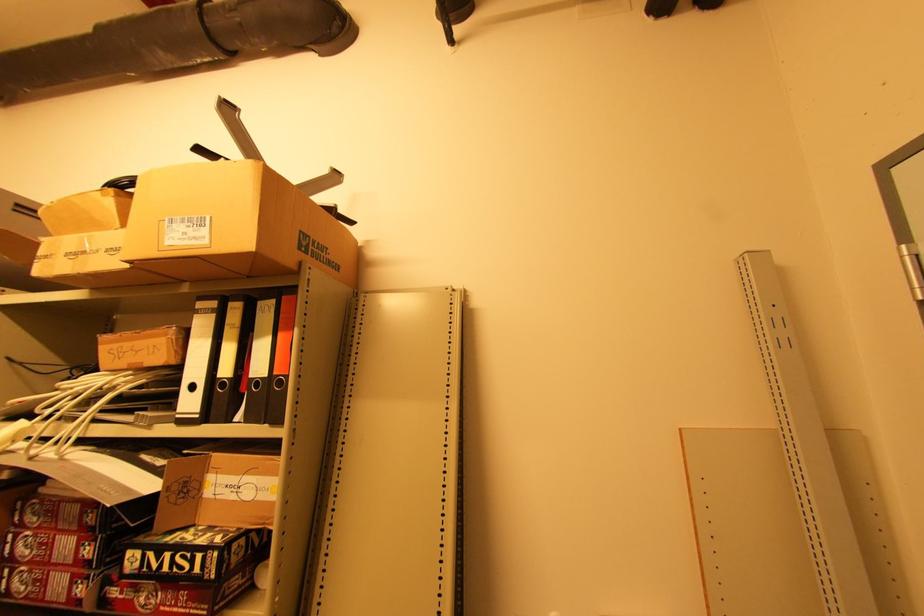
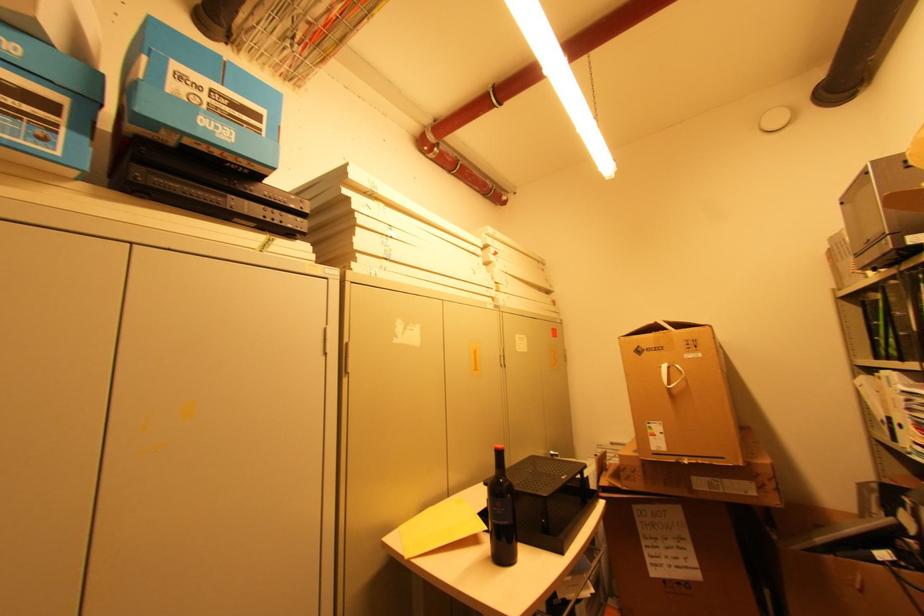
Question: The camera is either moving clockwise (left) or counter-clockwise (right) around the object. The first image is from the beginning of the video and the second image is from the end. Is the camera moving left or right when shooting the video?

Choices:
 (A) Left
 (B) Right

Answer: (B)